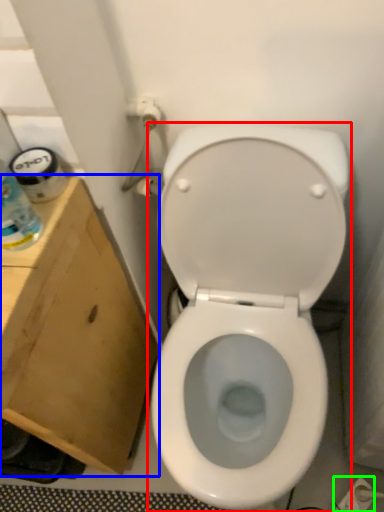
Question: Which object is positioned farthest from toilet (highlighted by a red box)? Select from cardboard box (highlighted by a blue box) and electric outlet (highlighted by a green box).

Choices:
 (A) cardboard box
 (B) electric outlet

Answer: (B)